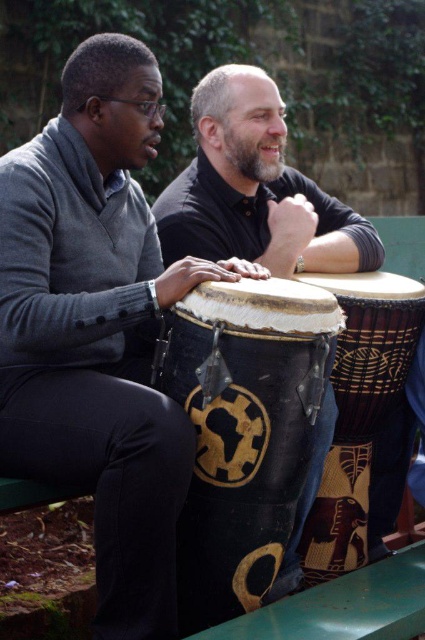
Who is positioned more to the right, matte black drum at left or black textured drum at center?

black textured drum at center is more to the right.

The height and width of the screenshot is (640, 425). In order to click on matte black drum at left in this screenshot , I will do `click(98, 328)`.

Does point (320, 467) come in front of point (320, 282)?

Yes, it is in front of point (320, 282).

Is matte black drum at center below natural wood drum at center?

Actually, matte black drum at center is above natural wood drum at center.

Which is in front, point (235, 115) or point (314, 275)?

Point (314, 275) is more forward.

In order to click on matte black drum at center in this screenshot , I will do `click(255, 189)`.

Can you confirm if matte black drum at left is positioned to the left of matte black drum at center?

Indeed, matte black drum at left is positioned on the left side of matte black drum at center.

In the scene shown: Which is below, matte black drum at left or matte black drum at center?

matte black drum at left is lower down.

Is point (113, 426) positioned in front of point (317, 227)?

Yes.

I want to click on matte black drum at left, so click(x=98, y=328).